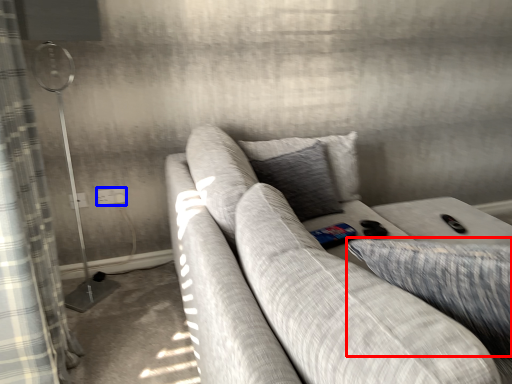
Question: Which point is closer to the camera, pillow (highlighted by a red box) or electric outlet (highlighted by a blue box)?

Choices:
 (A) pillow
 (B) electric outlet

Answer: (A)